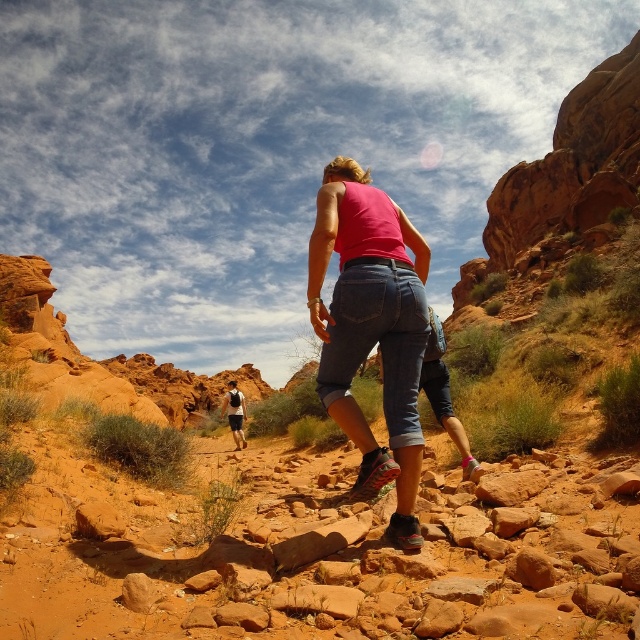
You are standing at the center of the image and want to locate the matte pink tank top at center. Based on the coordinates provided, in which direction should you look to find it?

The matte pink tank top at center is located at coordinates point (371, 328), which is slightly to the upper right from the exact center. So you should look towards the upper right direction to find it.

You are a hiker trying to decide which clothing item to wear for the hike. You have a matte pink tank top at center and a white mesh shirt at center. Based on their positions in the image, which one is more visible to someone approaching from behind?

The matte pink tank top at center is closer to the viewer than the white mesh shirt at center, so the matte pink tank top at center would be more visible to someone approaching from behind.

In the scene shown: You are navigating through a desert hiking trail and see two points marked on your map. The first point is at coordinate point (356, 432) and the second is at point (236, 381). Which point is closer to your current position if you are standing behind the woman walking away from you?

Point (356, 432) is in front of point (236, 381), so the point closer to your current position would be point (356, 432) since it is closer to you.